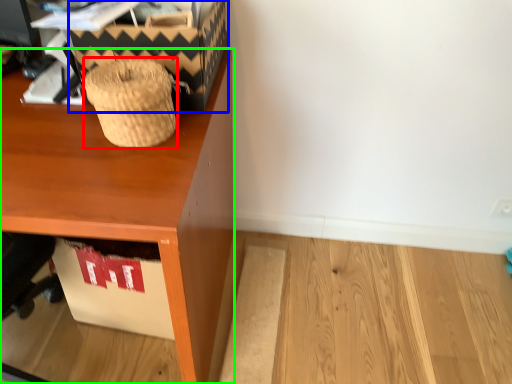
Question: Estimate the real-world distances between objects in this image. Which object is farther from basket (highlighted by a red box), shoe box (highlighted by a blue box) or desk (highlighted by a green box)?

Choices:
 (A) shoe box
 (B) desk

Answer: (B)